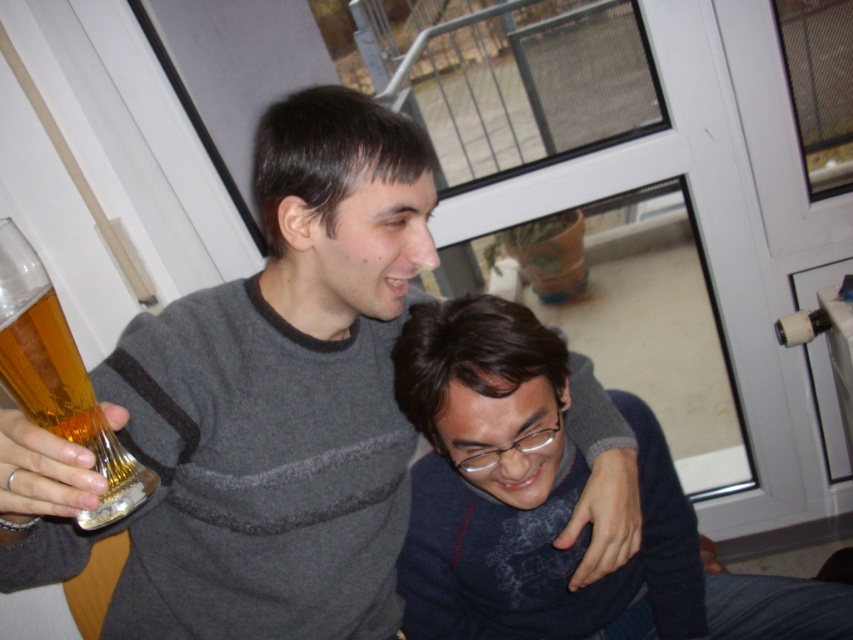
You are standing in front of the image and want to locate the gray striped sweater at upper center. What are its coordinates?

The gray striped sweater at upper center is located at coordinates (282, 396).

You are a photographer trying to capture a candid shot of the dark blue sweater at lower right and the translucent glass beer at left. Since you want to ensure both are in focus, you need to know their relative sizes. Which object is larger?

The dark blue sweater at lower right is bigger than the translucent glass beer at left, so you should focus on the larger object first to ensure both are in focus.

You are a photographer trying to capture a candid shot of the two people in the scene. You want to ensure that the focus is on the person closer to the camera. Given that the camera can only focus on objects within 35 inches, will the point at coordinates point (138, 362) be within the focus range?

The point (138, 362) is 36.20 inches from the camera, which is beyond the 35 inches focus range. Therefore, the camera will not be able to focus on that point.